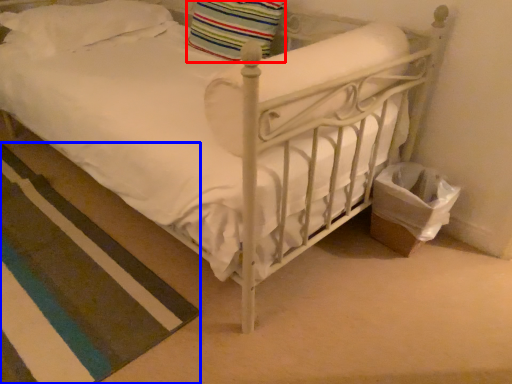
Question: Which point is further to the camera, pillow (highlighted by a red box) or strip (highlighted by a blue box)?

Choices:
 (A) pillow
 (B) strip

Answer: (A)